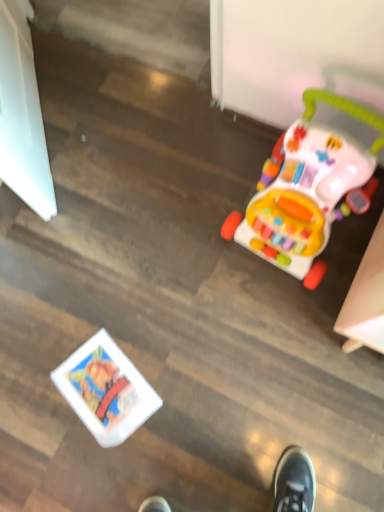
Image resolution: width=384 pixels, height=512 pixels. Identify the location of free point below white glossy book at lower left, which is the 2th toy from right to left (from a real-world perspective). (110, 384).